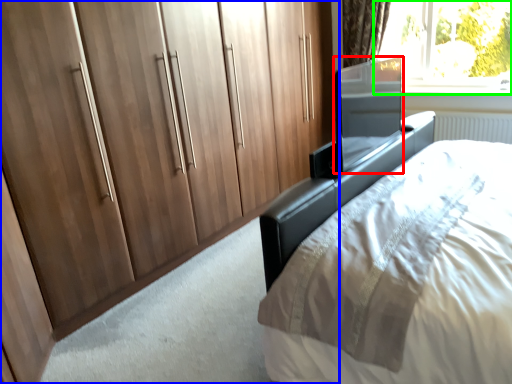
Question: Which object is the farthest from screen door (highlighted by a red box)? Choose among these: cupboard (highlighted by a blue box) or window (highlighted by a green box).

Choices:
 (A) cupboard
 (B) window

Answer: (B)